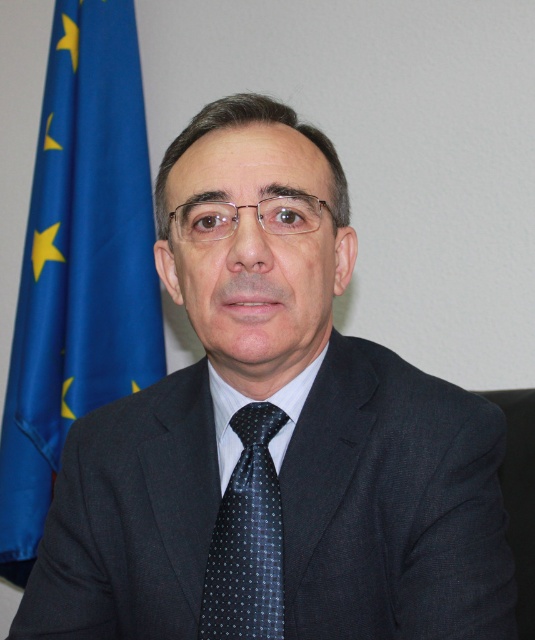
Can you confirm if blue fabric flag at left is bigger than dark blue dotted tie at center?

Yes, blue fabric flag at left is bigger than dark blue dotted tie at center.

Who is more distant from viewer, [132,150] or [273,435]?

The point [132,150] is more distant.

Where is `blue fabric flag at left`? The image size is (535, 640). blue fabric flag at left is located at coordinates (x=79, y=262).

Is point (147, 189) positioned behind point (240, 444)?

That is True.

Is point (43, 353) closer to camera compared to point (282, 449)?

No, it is not.

You are a GUI agent. You are given a task and a screenshot of the screen. Output one action in this format:
    pyautogui.click(x=<x>, y=<y>)
    Task: Click on the blue fabric flag at left
    Image resolution: width=535 pixels, height=640 pixels.
    Given the screenshot: What is the action you would take?
    pyautogui.click(x=79, y=262)

Who is positioned more to the right, dark blue dotted tie at center or white smooth dress shirt at center?

white smooth dress shirt at center

Who is more distant from viewer, (214, 577) or (211, 396)?

The point (211, 396) is more distant.

Find the location of a particular element. dark blue dotted tie at center is located at coordinates (247, 538).